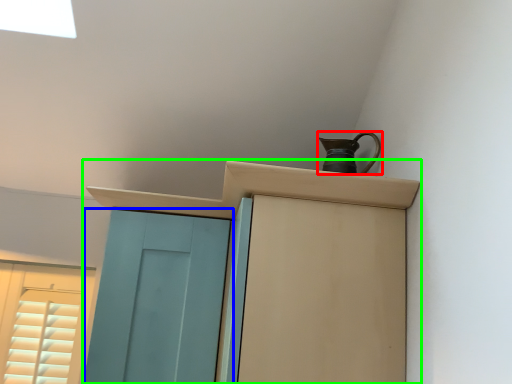
Question: Which is nearer to the jug (highlighted by a red box)? door (highlighted by a blue box) or cupboard (highlighted by a green box).

Choices:
 (A) door
 (B) cupboard

Answer: (B)